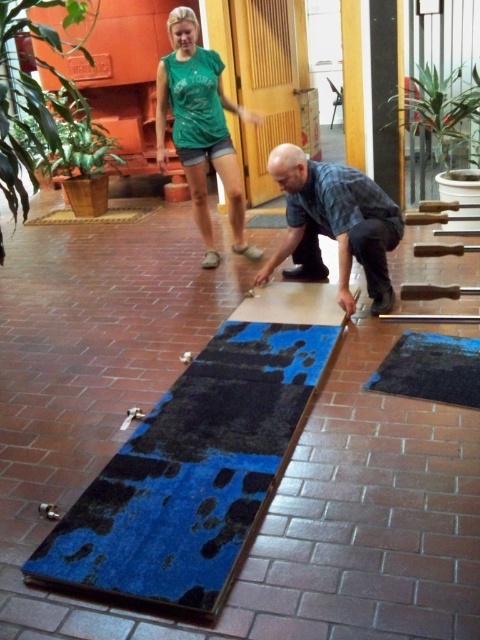
Question: Can you confirm if green cotton shirt at upper center is positioned above green leafy plant at upper right?

Choices:
 (A) no
 (B) yes

Answer: (A)

Question: Does blue felt mat at center appear over blue fabric at center?

Choices:
 (A) yes
 (B) no

Answer: (B)

Question: Which point appears farthest from the camera in this image?

Choices:
 (A) (219, 120)
 (B) (444, 166)
 (C) (435, 380)

Answer: (B)

Question: Among these objects, which one is nearest to the camera?

Choices:
 (A) blue fabric at center
 (B) blue rubber mat at lower center
 (C) green leafy plant at upper right
 (D) green cotton shirt at upper center

Answer: (B)

Question: Is blue felt mat at center wider than green cotton shirt at upper center?

Choices:
 (A) yes
 (B) no

Answer: (A)

Question: Which object appears closest to the camera in this image?

Choices:
 (A) blue rubber mat at lower center
 (B) blue fabric at center
 (C) green leafy plant at upper right

Answer: (A)